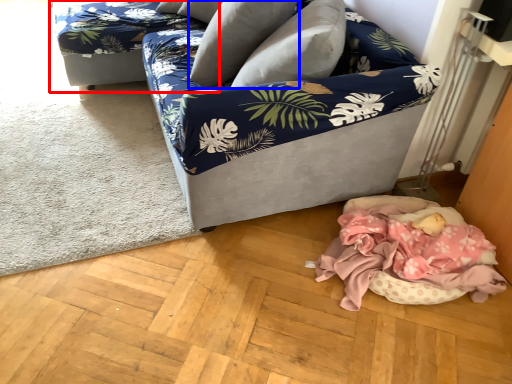
Question: Which object appears farthest to the camera in this image, couch (highlighted by a red box) or pillow (highlighted by a blue box)?

Choices:
 (A) couch
 (B) pillow

Answer: (A)